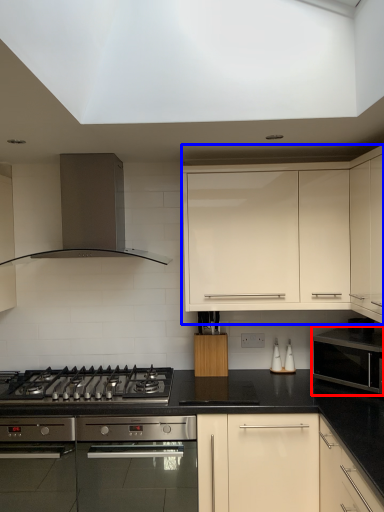
Question: Among these objects, which one is nearest to the camera, microwave oven (highlighted by a red box) or cabinetry (highlighted by a blue box)?

Choices:
 (A) microwave oven
 (B) cabinetry

Answer: (A)